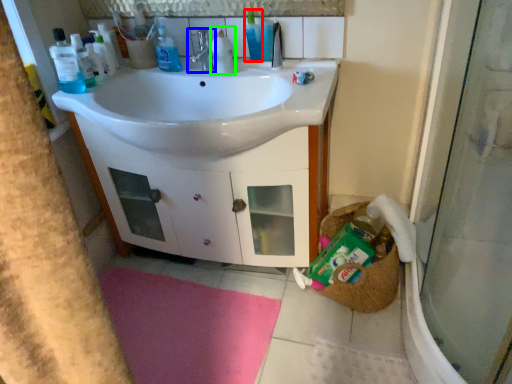
Question: Which is farther away from toiletry (highlighted by a red box)? tap (highlighted by a blue box) or cleaning product (highlighted by a green box)?

Choices:
 (A) tap
 (B) cleaning product

Answer: (A)